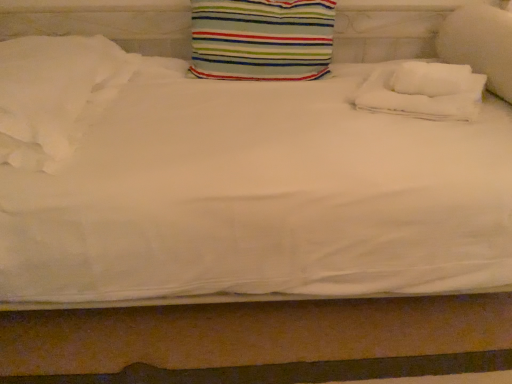
Question: Considering the relative sizes of striped fabric pillow at center, the second pillow positioned from the left, and white soft towel at upper right, the 3th pillow when ordered from left to right, in the image provided, is striped fabric pillow at center, the second pillow positioned from the left, shorter than white soft towel at upper right, the 3th pillow when ordered from left to right,?

Choices:
 (A) no
 (B) yes

Answer: (A)

Question: Is white soft towel at upper right, marked as the second pillow in a right-to-left arrangement, at the back of striped fabric pillow at center, the second pillow positioned from the left?

Choices:
 (A) no
 (B) yes

Answer: (A)

Question: From a real-world perspective, is striped fabric pillow at center, the second pillow positioned from the left, on top of white soft towel at upper right, marked as the second pillow in a right-to-left arrangement?

Choices:
 (A) no
 (B) yes

Answer: (B)

Question: Is striped fabric pillow at center, positioned as the third pillow in right-to-left order, further to the viewer compared to white soft towel at upper right, the 3th pillow when ordered from left to right?

Choices:
 (A) yes
 (B) no

Answer: (A)

Question: Does striped fabric pillow at center, positioned as the third pillow in right-to-left order, contain white soft towel at upper right, the 3th pillow when ordered from left to right?

Choices:
 (A) yes
 (B) no

Answer: (B)

Question: Relative to white soft towel at upper right, marked as the second pillow in a right-to-left arrangement, is white soft pillow at left, which is the fourth pillow in right-to-left order, in front or behind?

Choices:
 (A) front
 (B) behind

Answer: (A)

Question: Does point (16, 41) appear closer or farther from the camera than point (430, 105)?

Choices:
 (A) farther
 (B) closer

Answer: (A)

Question: Considering the positions of white soft pillow at left, which is the fourth pillow in right-to-left order, and white soft towel at upper right, marked as the second pillow in a right-to-left arrangement, in the image, is white soft pillow at left, which is the fourth pillow in right-to-left order, taller or shorter than white soft towel at upper right, marked as the second pillow in a right-to-left arrangement,?

Choices:
 (A) tall
 (B) short

Answer: (A)

Question: From a real-world perspective, relative to white soft towel at upper right, marked as the second pillow in a right-to-left arrangement, is white soft pillow at left, which is the fourth pillow in right-to-left order, vertically above or below?

Choices:
 (A) below
 (B) above

Answer: (B)

Question: Is striped fabric pillow at center, positioned as the third pillow in right-to-left order, in front of or behind white soft pillow at left, placed as the 1th pillow when sorted from left to right, in the image?

Choices:
 (A) front
 (B) behind

Answer: (B)

Question: From their relative heights in the image, would you say striped fabric pillow at center, the second pillow positioned from the left, is taller or shorter than white soft pillow at left, placed as the 1th pillow when sorted from left to right?

Choices:
 (A) tall
 (B) short

Answer: (A)

Question: In terms of size, does striped fabric pillow at center, positioned as the third pillow in right-to-left order, appear bigger or smaller than white soft pillow at left, placed as the 1th pillow when sorted from left to right?

Choices:
 (A) big
 (B) small

Answer: (B)

Question: From the image's perspective, relative to white soft pillow at left, placed as the 1th pillow when sorted from left to right, is striped fabric pillow at center, positioned as the third pillow in right-to-left order, above or below?

Choices:
 (A) below
 (B) above

Answer: (B)

Question: Based on their positions, is white soft pillow at right, which is the 1th pillow in right-to-left order, located to the left or right of white soft pillow at left, placed as the 1th pillow when sorted from left to right?

Choices:
 (A) left
 (B) right

Answer: (B)

Question: Considering the positions of white soft pillow at right, placed as the 4th pillow when sorted from left to right, and white soft pillow at left, which is the fourth pillow in right-to-left order, in the image, is white soft pillow at right, placed as the 4th pillow when sorted from left to right, wider or thinner than white soft pillow at left, which is the fourth pillow in right-to-left order,?

Choices:
 (A) wide
 (B) thin

Answer: (B)